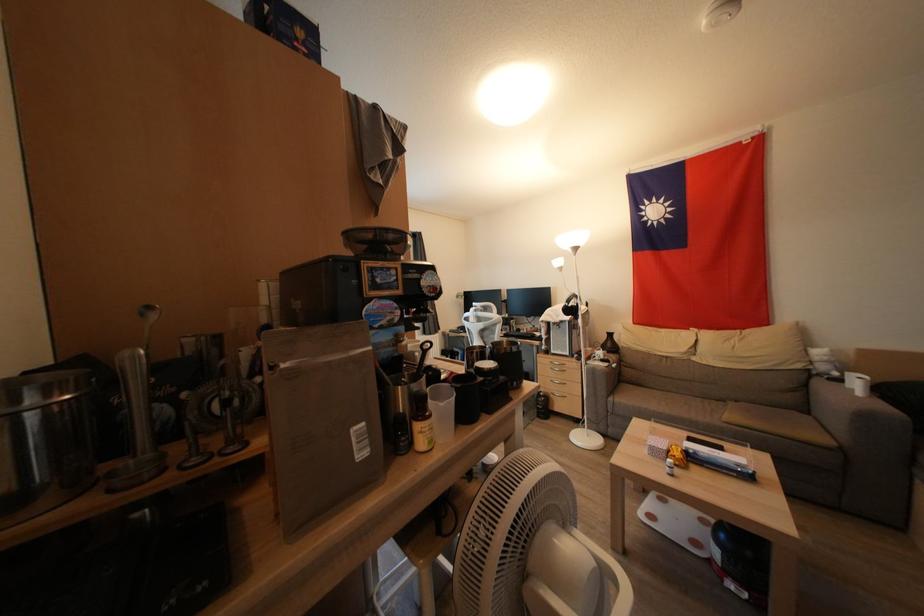
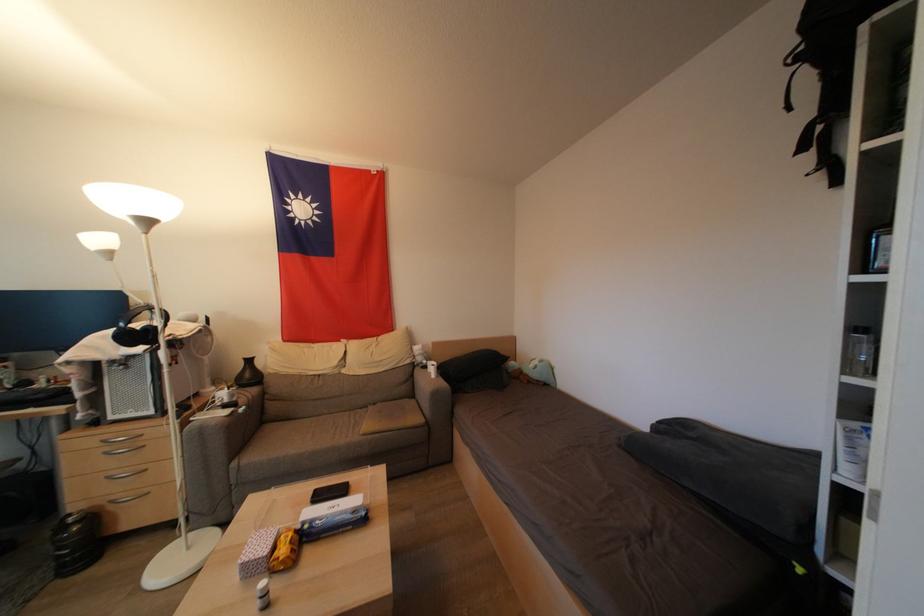
Find the pixel in the second image that matches (580,253) in the first image.

(152, 225)